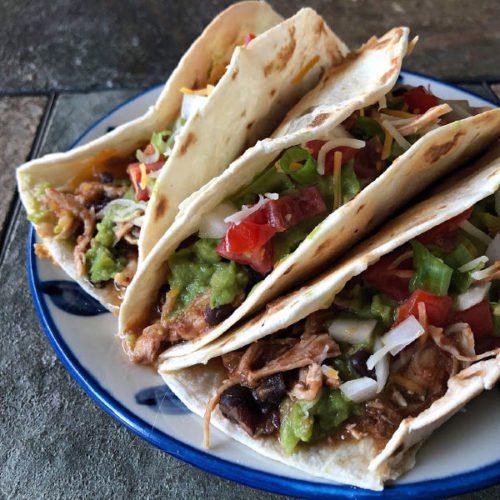
The image size is (500, 500). I want to click on grey grout between counter tiles, so click(x=49, y=115), click(x=10, y=236).